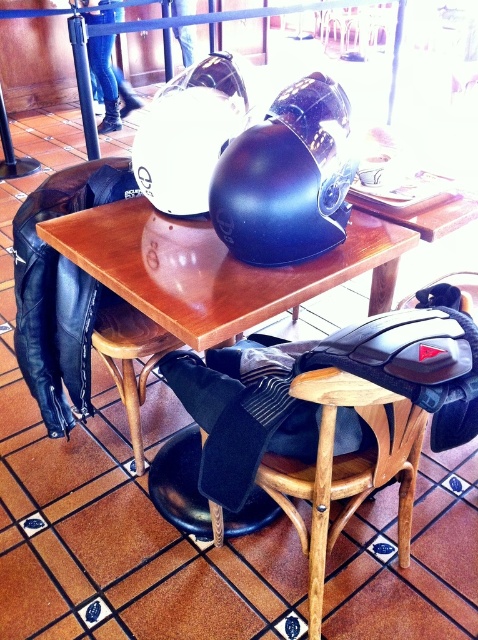
Between wooden chair at lower center and matte black helmet at center, which one appears on the right side from the viewer's perspective?

wooden chair at lower center

Which of these two, wooden chair at lower center or matte black helmet at center, stands taller?

With more height is wooden chair at lower center.

Which is behind, point (310, 472) or point (198, 200)?

The point (198, 200) is more distant.

Find the location of a particular element. The height and width of the screenshot is (640, 478). wooden chair at lower center is located at coordinates (345, 468).

Which is more to the right, brown leather chair at center or wooden chair at lower center?

wooden chair at lower center

Between point (85, 179) and point (375, 481), which one is positioned in front?

Point (375, 481) is more forward.

Where is `brown leather chair at center`? The image size is (478, 640). brown leather chair at center is located at coordinates (62, 291).

Is point (152, 330) closer to camera compared to point (313, 634)?

No, (152, 330) is behind (313, 634).

Between point (171, 310) and point (339, 496), which one is positioned in front?

Positioned in front is point (171, 310).

Where is `wooden table at center`? This screenshot has width=478, height=640. wooden table at center is located at coordinates (202, 282).